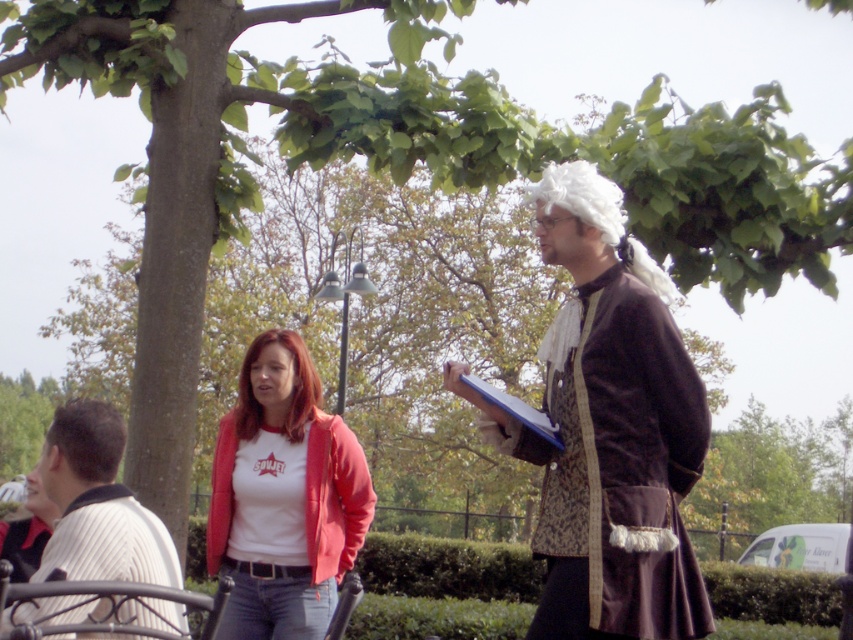
Question: Which of the following is the closest to the observer?

Choices:
 (A) (596, 179)
 (B) (109, 536)
 (C) (57, 435)
 (D) (595, 476)

Answer: (B)

Question: Based on their relative distances, which object is nearer to the blonde synthetic wig at center?

Choices:
 (A) white textured shirt at left
 (B) brown fuzzy wig at upper left
 (C) blue paper clipboard at right
 (D) brown velvet coat at right

Answer: (C)

Question: Among these points, which one is nearest to the camera?

Choices:
 (A) (120, 426)
 (B) (65, 410)

Answer: (A)

Question: Is brown velvet coat at right further to camera compared to blue paper clipboard at right?

Choices:
 (A) yes
 (B) no

Answer: (B)

Question: Does brown velvet coat at right have a greater width compared to white fluffy wig at upper right?

Choices:
 (A) yes
 (B) no

Answer: (A)

Question: Is blonde synthetic wig at center below blue paper clipboard at right?

Choices:
 (A) yes
 (B) no

Answer: (B)